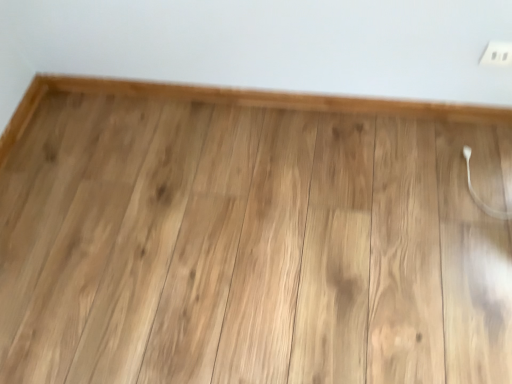
What do you see at coordinates (258, 99) in the screenshot? This screenshot has height=384, width=512. I see `light wood ledge at upper center` at bounding box center [258, 99].

This screenshot has height=384, width=512. I want to click on light wood ledge at upper center, so click(258, 99).

Measure the distance between light wood ledge at upper center and camera.

light wood ledge at upper center is 4.58 feet away from camera.

Where is `light wood ledge at upper center`? The width and height of the screenshot is (512, 384). light wood ledge at upper center is located at coordinates (258, 99).